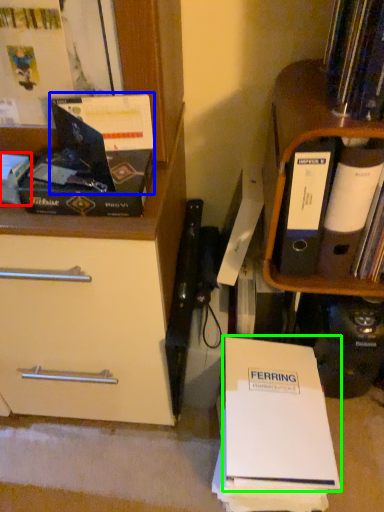
Question: Considering the real-world distances, which object is closest to book (highlighted by a red box)? paperback book (highlighted by a blue box) or paperback book (highlighted by a green box).

Choices:
 (A) paperback book
 (B) paperback book

Answer: (A)